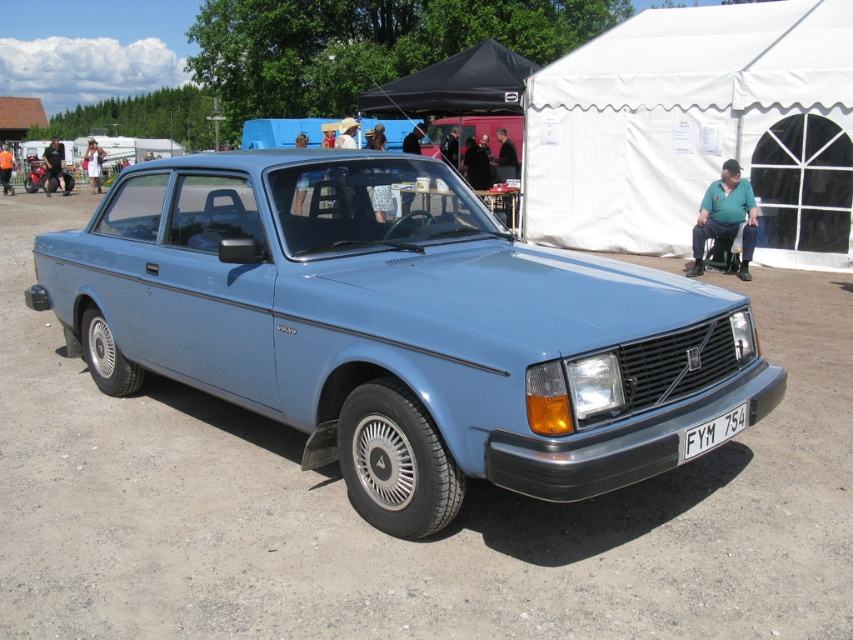
Question: Which point is farther from the camera taking this photo?

Choices:
 (A) (726, 416)
 (B) (538, 241)
 (C) (730, 234)

Answer: (B)

Question: Which of the following is the farthest from the observer?

Choices:
 (A) white fabric tent at upper right
 (B) light blue metallic car at center
 (C) white plastic license plate at front

Answer: (A)

Question: In this image, where is white fabric tent at upper right located relative to white plastic license plate at front?

Choices:
 (A) right
 (B) left

Answer: (A)

Question: Does white fabric tent at upper right appear on the right side of white plastic license plate at front?

Choices:
 (A) no
 (B) yes

Answer: (B)

Question: Does light blue metallic car at center lie in front of white plastic license plate at front?

Choices:
 (A) no
 (B) yes

Answer: (B)

Question: Which object is the farthest from the light blue matte car at center?

Choices:
 (A) white fabric tent at upper right
 (B) light blue metallic car at center

Answer: (B)